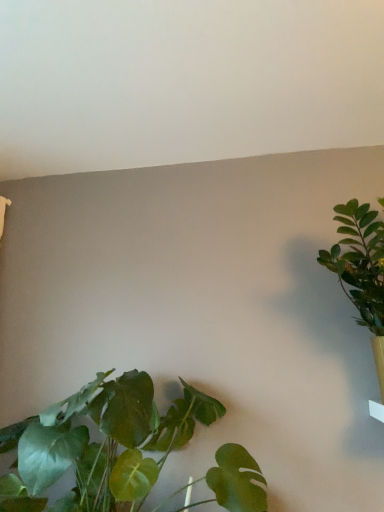
Question: From a real-world perspective, is green leafy plant at right, positioned as the first houseplant in right-to-left order, located beneath green leafy plant at lower left, which is counted as the 2th houseplant, starting from the right?

Choices:
 (A) yes
 (B) no

Answer: (B)

Question: Is green leafy plant at right, positioned as the first houseplant in right-to-left order, taller than green leafy plant at lower left, which is counted as the 2th houseplant, starting from the right?

Choices:
 (A) yes
 (B) no

Answer: (A)

Question: Does green leafy plant at right, positioned as the first houseplant in right-to-left order, have a lesser height compared to green leafy plant at lower left, marked as the first houseplant in a left-to-right arrangement?

Choices:
 (A) no
 (B) yes

Answer: (A)

Question: Is green leafy plant at right, arranged as the 2th houseplant when viewed from the left, outside of green leafy plant at lower left, marked as the first houseplant in a left-to-right arrangement?

Choices:
 (A) yes
 (B) no

Answer: (A)

Question: Is green leafy plant at right, arranged as the 2th houseplant when viewed from the left, turned away from green leafy plant at lower left, marked as the first houseplant in a left-to-right arrangement?

Choices:
 (A) no
 (B) yes

Answer: (A)

Question: Is green leafy plant at right, arranged as the 2th houseplant when viewed from the left, to the left of green leafy plant at lower left, which is counted as the 2th houseplant, starting from the right, from the viewer's perspective?

Choices:
 (A) yes
 (B) no

Answer: (B)

Question: Is green leafy plant at lower left, marked as the first houseplant in a left-to-right arrangement, taller than green leafy plant at right, positioned as the first houseplant in right-to-left order?

Choices:
 (A) no
 (B) yes

Answer: (A)

Question: Can you confirm if green leafy plant at lower left, which is counted as the 2th houseplant, starting from the right, is positioned to the right of green leafy plant at right, arranged as the 2th houseplant when viewed from the left?

Choices:
 (A) yes
 (B) no

Answer: (B)

Question: Is the position of green leafy plant at lower left, marked as the first houseplant in a left-to-right arrangement, less distant than that of green leafy plant at right, arranged as the 2th houseplant when viewed from the left?

Choices:
 (A) no
 (B) yes

Answer: (B)

Question: Would you say green leafy plant at lower left, which is counted as the 2th houseplant, starting from the right, is a long distance from green leafy plant at right, positioned as the first houseplant in right-to-left order?

Choices:
 (A) no
 (B) yes

Answer: (A)

Question: Considering the relative sizes of green leafy plant at lower left, which is counted as the 2th houseplant, starting from the right, and green leafy plant at right, arranged as the 2th houseplant when viewed from the left, in the image provided, is green leafy plant at lower left, which is counted as the 2th houseplant, starting from the right, shorter than green leafy plant at right, arranged as the 2th houseplant when viewed from the left,?

Choices:
 (A) no
 (B) yes

Answer: (B)

Question: Is green leafy plant at lower left, marked as the first houseplant in a left-to-right arrangement, turned away from green leafy plant at right, positioned as the first houseplant in right-to-left order?

Choices:
 (A) no
 (B) yes

Answer: (A)

Question: Choose the correct answer: Is green leafy plant at right, arranged as the 2th houseplant when viewed from the left, inside green leafy plant at lower left, marked as the first houseplant in a left-to-right arrangement, or outside it?

Choices:
 (A) outside
 (B) inside

Answer: (A)